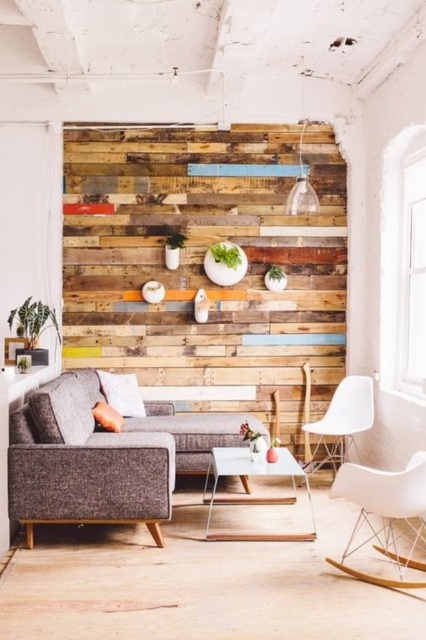
Does wooden planks at center have a lesser width compared to white glass coffee table at center?

No, wooden planks at center is not thinner than white glass coffee table at center.

Is wooden planks at center in front of white glass coffee table at center?

No, wooden planks at center is further to the viewer.

Image resolution: width=426 pixels, height=640 pixels. Describe the element at coordinates (201, 262) in the screenshot. I see `wooden planks at center` at that location.

The image size is (426, 640). I want to click on wooden planks at center, so click(201, 262).

Does white matte rocking chair at lower right have a lesser width compared to white plastic chair at right?

In fact, white matte rocking chair at lower right might be wider than white plastic chair at right.

Who is taller, white matte rocking chair at lower right or white plastic chair at right?

With more height is white matte rocking chair at lower right.

Is point (367, 497) positioned before point (354, 378)?

Yes, point (367, 497) is in front of point (354, 378).

This screenshot has width=426, height=640. Find the location of `white matte rocking chair at lower right`. white matte rocking chair at lower right is located at coordinates (383, 513).

How far apart are textured gray couch at left and white plastic chair at right?

The distance of textured gray couch at left from white plastic chair at right is 4.38 feet.

Does textured gray couch at left have a greater width compared to white plastic chair at right?

Yes, textured gray couch at left is wider than white plastic chair at right.

Describe the element at coordinates (100, 456) in the screenshot. I see `textured gray couch at left` at that location.

The image size is (426, 640). Find the location of `textured gray couch at left`. textured gray couch at left is located at coordinates (100, 456).